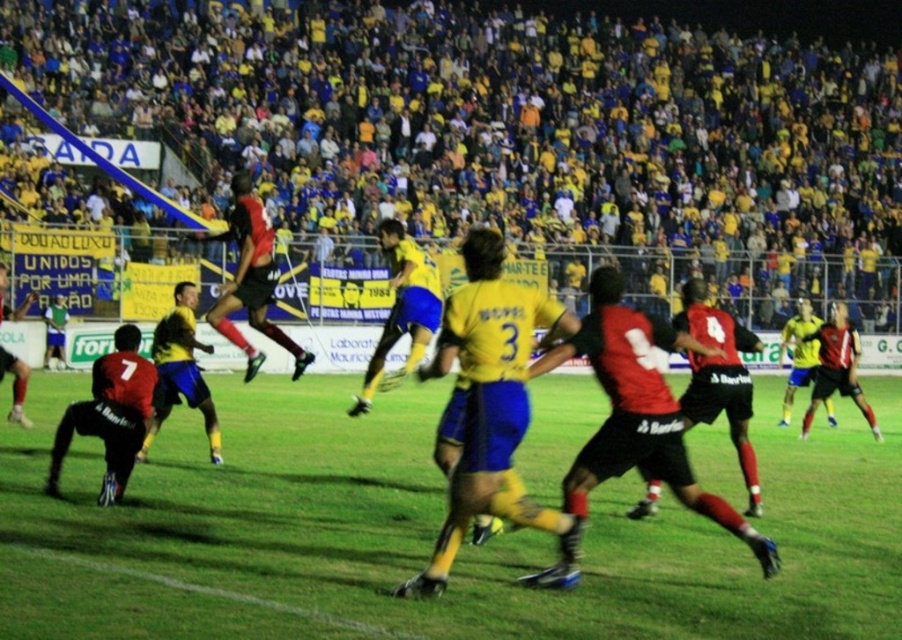
Question: Which of the following is the farthest from the observer?

Choices:
 (A) (205, 609)
 (B) (108, 374)

Answer: (B)

Question: Is green grass football field at center above matte black jersey at lower left?

Choices:
 (A) yes
 (B) no

Answer: (B)

Question: Which of the following is the closest to the observer?

Choices:
 (A) green grass football field at center
 (B) matte black jersey at lower left

Answer: (A)

Question: Is green grass football field at center behind matte black jersey at lower left?

Choices:
 (A) yes
 (B) no

Answer: (B)

Question: Does green grass football field at center appear over matte black jersey at lower left?

Choices:
 (A) no
 (B) yes

Answer: (A)